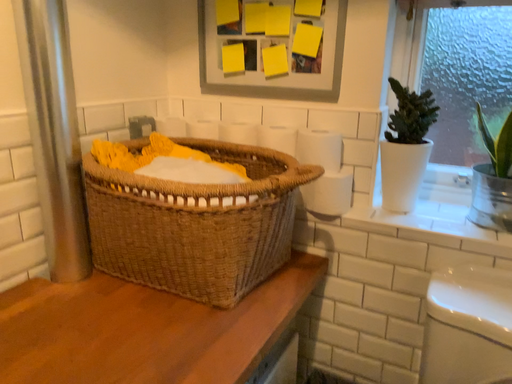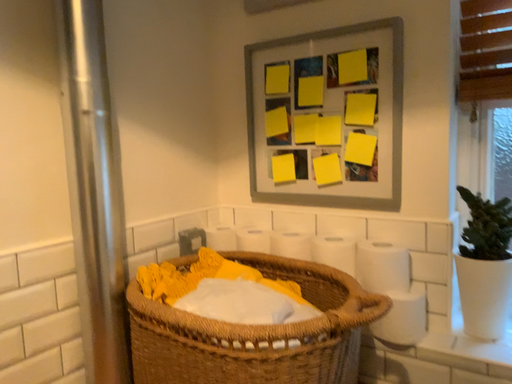
Question: Which way did the camera rotate in the video?

Choices:
 (A) rotated downward
 (B) rotated upward

Answer: (B)